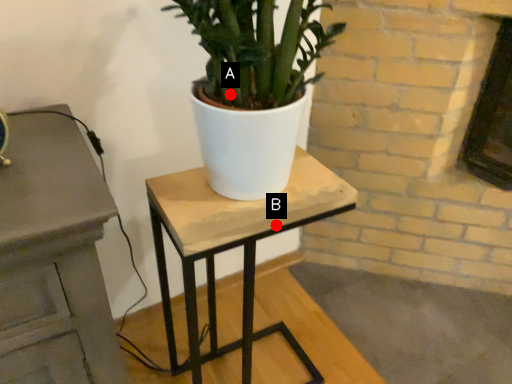
Question: Two points are circled on the image, labeled by A and B beside each circle. Among these points, which one is farthest from the camera?

Choices:
 (A) A is further
 (B) B is further

Answer: (B)